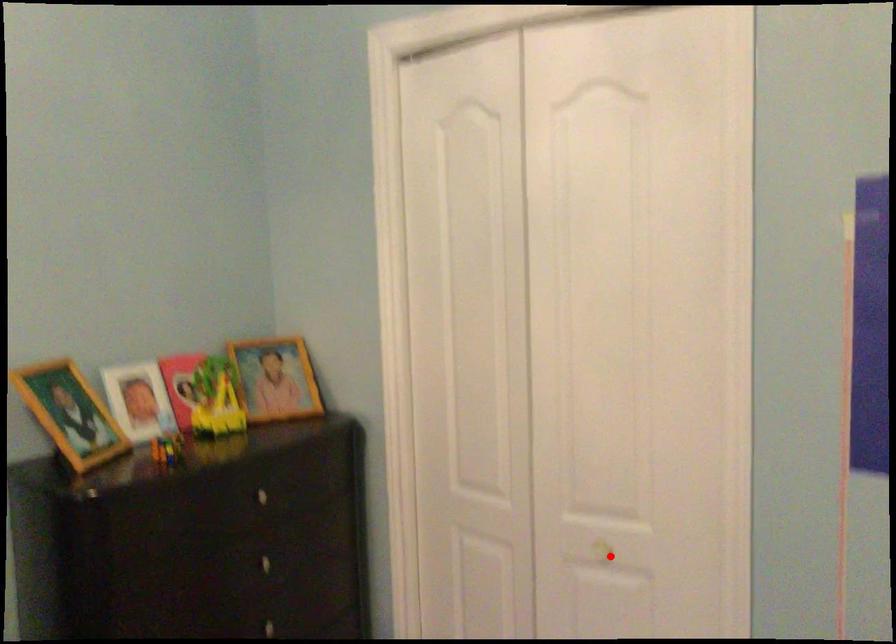
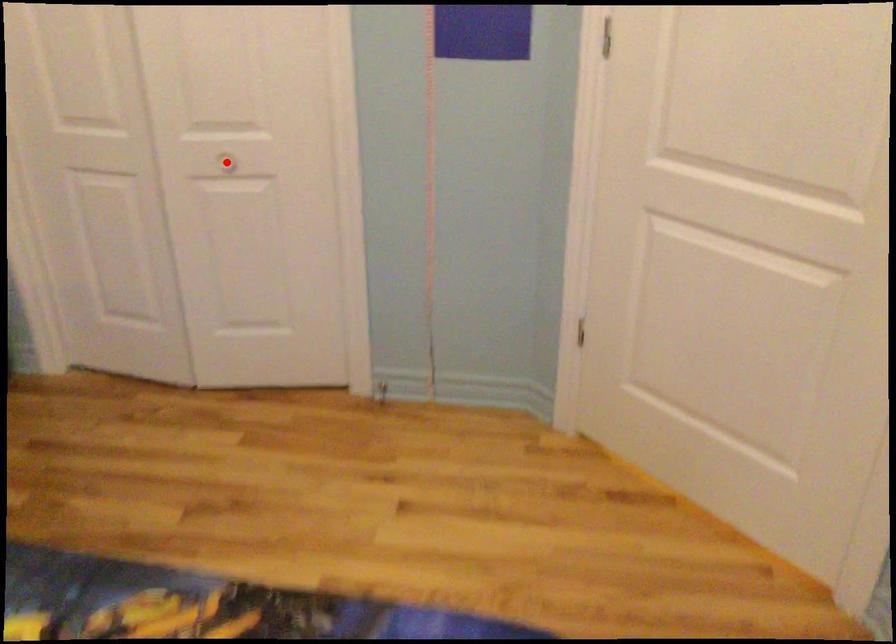
I am providing you with two images of the same scene from different viewpoints. A red point is marked on the first image and another point is marked on the second image. Is the red point in image1 aligned with the point shown in image2?

Yes